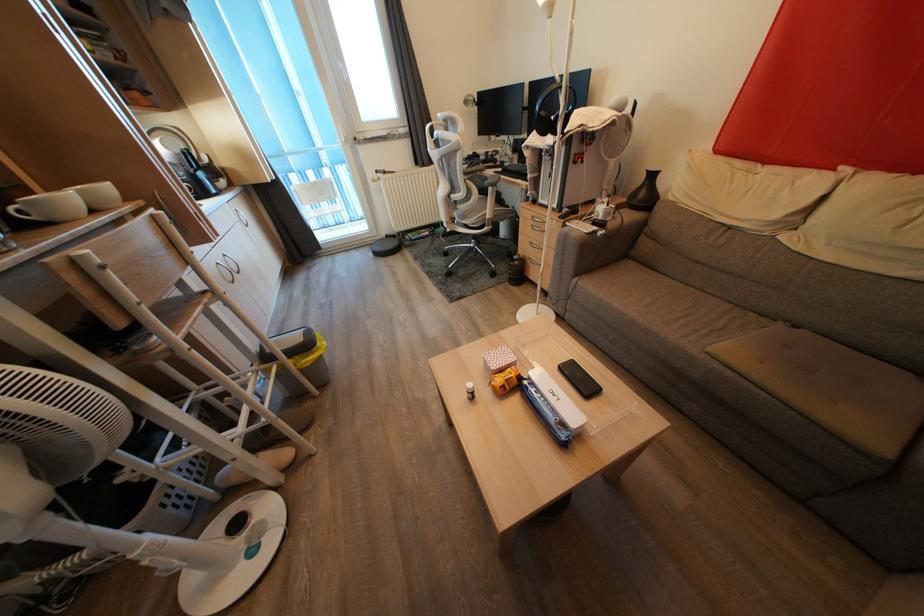
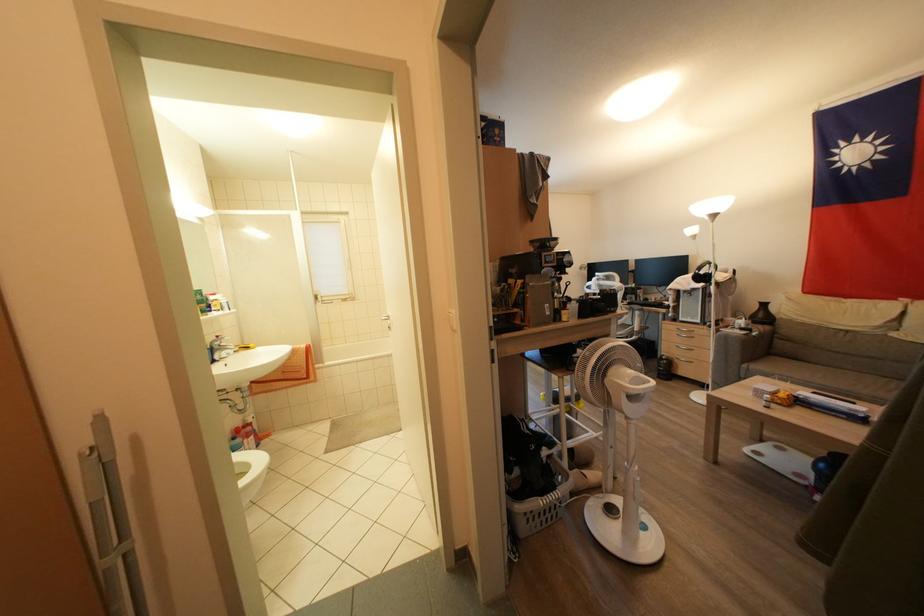
Locate, in the second image, the point that corresponds to [579,284] in the first image.

(748, 370)